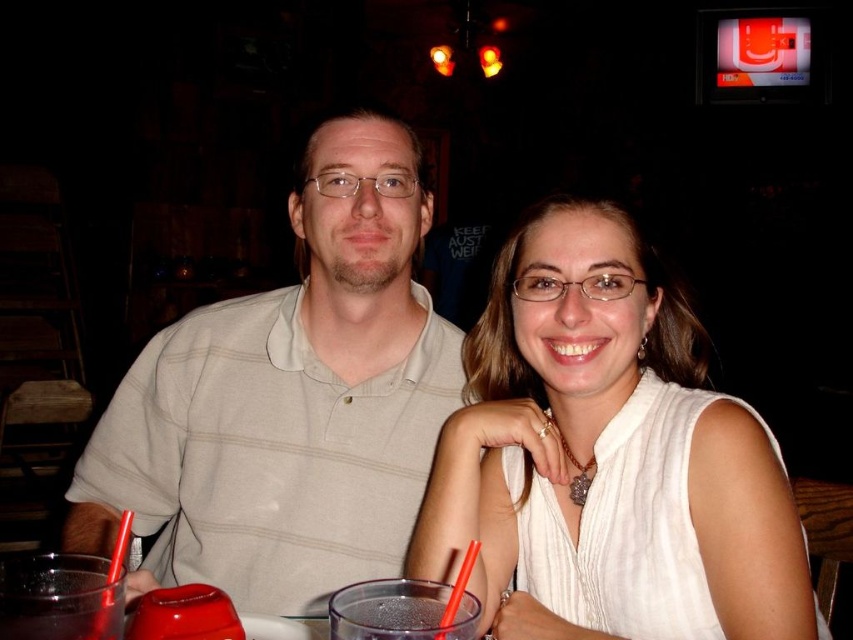
Question: Which of the following is the closest to the observer?

Choices:
 (A) click(100, 529)
 (B) click(720, 621)

Answer: (B)

Question: Is white silk blouse at center thinner than light beige striped polo shirt at center?

Choices:
 (A) no
 (B) yes

Answer: (B)

Question: Can you confirm if white silk blouse at center is positioned above light beige striped polo shirt at center?

Choices:
 (A) yes
 (B) no

Answer: (B)

Question: Does white silk blouse at center appear over light beige striped polo shirt at center?

Choices:
 (A) no
 (B) yes

Answer: (A)